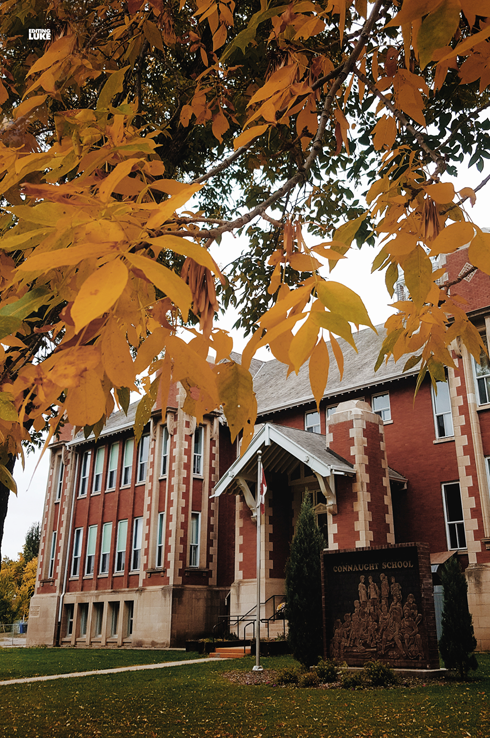
Locate an element on the screen. stair is located at coordinates (253, 635).